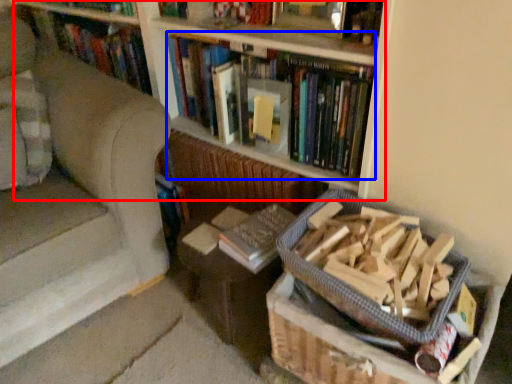
Question: Which point is closer to the camera, bookcase (highlighted by a red box) or book (highlighted by a blue box)?

Choices:
 (A) bookcase
 (B) book

Answer: (A)